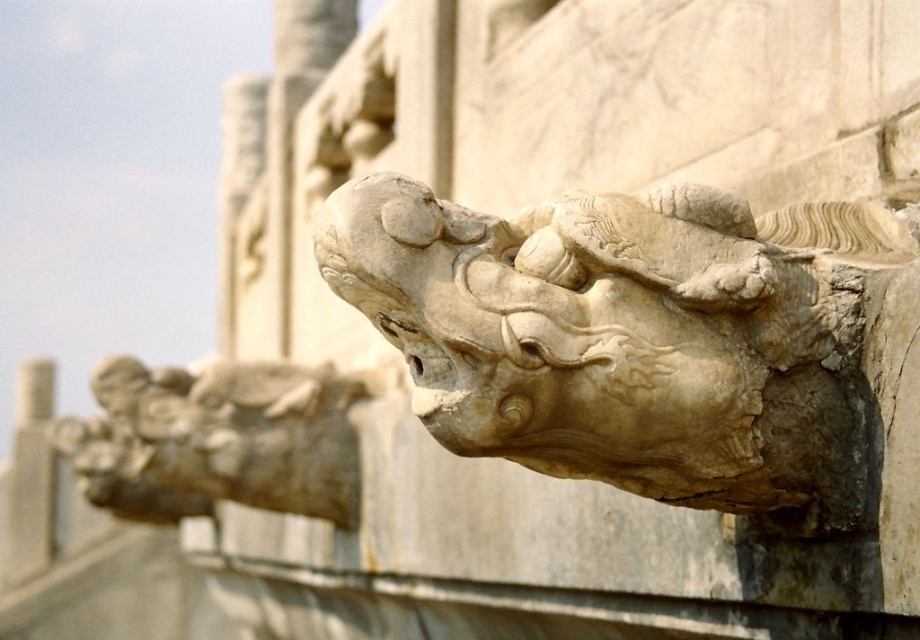
You are an architect designing a garden fountain and need to place two white stone dragons. The scene shows a white stone dragon at upper center and a white stone dragon at upper left. Which dragon should you choose if you want the one that is narrower?

The white stone dragon at upper center has a smaller width than the white stone dragon at upper left, so you should choose the white stone dragon at upper center for the narrower option.